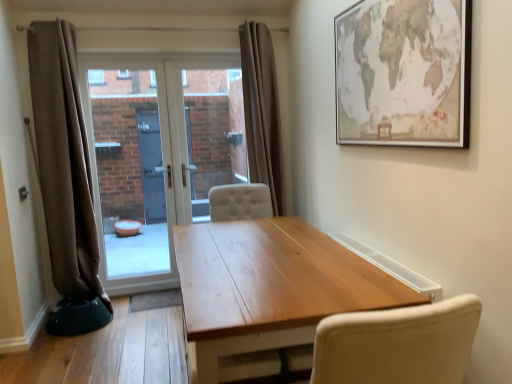
This screenshot has width=512, height=384. What are the coordinates of `wooden table at center` in the screenshot? It's located at (271, 283).

Looking at this image, measure the distance between point [231,253] and camera.

Point [231,253] is 2.28 meters away from camera.

What is the approximate width of brown fabric curtain at center, arranged as the second curtain when viewed from the left?

The width of brown fabric curtain at center, arranged as the second curtain when viewed from the left, is 12.93 inches.

Identify the location of transparent glass door at center, which is counted as the 1th window screen, starting from the left. The image size is (512, 384). (133, 170).

This screenshot has height=384, width=512. Find the location of `wooden table at center`. wooden table at center is located at coordinates (271, 283).

Considering the sizes of wooden table at center and transparent glass door at center, acting as the 1th window screen starting from the right, in the image, is wooden table at center taller or shorter than transparent glass door at center, acting as the 1th window screen starting from the right,?

Considering their sizes, wooden table at center has less height than transparent glass door at center, acting as the 1th window screen starting from the right.

Is wooden table at center touching transparent glass door at center, acting as the 1th window screen starting from the right?

No.

From the image's perspective, is wooden table at center located beneath transparent glass door at center, acting as the 1th window screen starting from the right?

Yes.

Is brown fabric curtain at left, which is the 2th curtain from right to left, not near brown fabric curtain at center, arranged as the second curtain when viewed from the left?

Indeed, brown fabric curtain at left, which is the 2th curtain from right to left, is not near brown fabric curtain at center, arranged as the second curtain when viewed from the left.

Is brown fabric curtain at left, which is the 2th curtain from right to left, oriented towards brown fabric curtain at center, the 1th curtain from the right?

No.

Between point (46, 81) and point (281, 203), which one is positioned in front?

The point (46, 81) is closer.

From the image's perspective, is brown fabric curtain at center, the 1th curtain from the right, on brown fabric curtain at left, which is the 2th curtain from right to left?

Yes.

Can you confirm if brown fabric curtain at center, arranged as the second curtain when viewed from the left, is taller than brown fabric curtain at left, the 1th curtain from the left?

Incorrect, the height of brown fabric curtain at center, arranged as the second curtain when viewed from the left, is not larger of that of brown fabric curtain at left, the 1th curtain from the left.

Which is behind, brown fabric curtain at center, arranged as the second curtain when viewed from the left, or brown fabric curtain at left, which is the 2th curtain from right to left?

brown fabric curtain at center, arranged as the second curtain when viewed from the left.

At what (x,y) coordinates should I click in order to perform the action: click on curtain behind the brown fabric curtain at left, which is the 2th curtain from right to left. Please return your answer as a coordinate pair (x, y). This screenshot has height=384, width=512. Looking at the image, I should click on (262, 110).

Considering the sizes of objects brown fabric curtain at center, arranged as the second curtain when viewed from the left, and white glossy door at center in the image provided, who is thinner, brown fabric curtain at center, arranged as the second curtain when viewed from the left, or white glossy door at center?

white glossy door at center.

Consider the image. Is brown fabric curtain at center, arranged as the second curtain when viewed from the left, not within white glossy door at center?

brown fabric curtain at center, arranged as the second curtain when viewed from the left, lies outside white glossy door at center's area.

From the image's perspective, between brown fabric curtain at center, arranged as the second curtain when viewed from the left, and white glossy door at center, which one is located above?

brown fabric curtain at center, arranged as the second curtain when viewed from the left.

Which is behind, point (261, 127) or point (206, 204)?

Positioned behind is point (206, 204).

From the image's perspective, is wooden table at center over white glossy door at center?

Actually, wooden table at center appears below white glossy door at center in the image.

From the picture: Would you consider wooden table at center to be distant from white glossy door at center?

Yes.

From a real-world perspective, which object rests below the other?

From a 3D spatial view, wooden table at center is below.

Where is `table below the white glossy door at center (from the image's perspective)`? Image resolution: width=512 pixels, height=384 pixels. table below the white glossy door at center (from the image's perspective) is located at coordinates (271, 283).

Which is behind, point (358, 295) or point (277, 130)?

The point (277, 130) is behind.

Is wooden table at center inside the boundaries of brown fabric curtain at center, the 1th curtain from the right, or outside?

The correct answer is: outside.

From the image's perspective, is wooden table at center below brown fabric curtain at center, the 1th curtain from the right?

Indeed, from the image's perspective, wooden table at center is shown beneath brown fabric curtain at center, the 1th curtain from the right.

Considering the relative sizes of white glossy door at center and wooden table at center in the image provided, is white glossy door at center shorter than wooden table at center?

In fact, white glossy door at center may be taller than wooden table at center.

From a real-world perspective, is white glossy door at center over wooden table at center?

Yes, from a real-world perspective, white glossy door at center is over wooden table at center

Is white glossy door at center at the right side of wooden table at center?

No, white glossy door at center is not to the right of wooden table at center.

Is white glossy door at center positioned beyond the bounds of wooden table at center?

Indeed, white glossy door at center is completely outside wooden table at center.

Where is `table in front of the transparent glass door at center, which is the second window screen from left to right`? table in front of the transparent glass door at center, which is the second window screen from left to right is located at coordinates (271, 283).

Find the location of a particular element. Image resolution: width=512 pixels, height=384 pixels. curtain behind the brown fabric curtain at left, the 1th curtain from the left is located at coordinates (262, 110).

Which object lies nearer to the anchor point brown fabric curtain at center, arranged as the second curtain when viewed from the left, matte paper map at upper right or transparent glass door at center, acting as the 1th window screen starting from the right?

Among the two, transparent glass door at center, acting as the 1th window screen starting from the right, is located nearer to brown fabric curtain at center, arranged as the second curtain when viewed from the left.

Looking at the image, which one is located further to matte paper map at upper right, brown fabric curtain at center, arranged as the second curtain when viewed from the left, or wooden table at center?

brown fabric curtain at center, arranged as the second curtain when viewed from the left, lies further to matte paper map at upper right than the other object.

Looking at the image, which one is located closer to brown fabric curtain at center, arranged as the second curtain when viewed from the left, white glossy door at center or transparent glass door at center, which is counted as the 1th window screen, starting from the left?

white glossy door at center lies closer to brown fabric curtain at center, arranged as the second curtain when viewed from the left, than the other object.

From the image, which object appears to be farther from wooden table at center, transparent glass door at center, which is counted as the 1th window screen, starting from the left, or brown fabric curtain at center, arranged as the second curtain when viewed from the left?

transparent glass door at center, which is counted as the 1th window screen, starting from the left, is further to wooden table at center.

Looking at the image, which one is located further to matte paper map at upper right, brown fabric curtain at center, the 1th curtain from the right, or brown fabric curtain at left, which is the 2th curtain from right to left?

brown fabric curtain at left, which is the 2th curtain from right to left, is further to matte paper map at upper right.

From the image, which object appears to be nearer to wooden table at center, brown fabric curtain at center, the 1th curtain from the right, or brown fabric curtain at left, which is the 2th curtain from right to left?

Among the two, brown fabric curtain at center, the 1th curtain from the right, is located nearer to wooden table at center.

Considering their positions, is transparent glass door at center, which is counted as the 1th window screen, starting from the left, positioned closer to transparent glass door at center, which is the second window screen from left to right, than white glossy door at center?

The object closer to transparent glass door at center, which is the second window screen from left to right, is white glossy door at center.

Looking at the image, which one is located closer to transparent glass door at center, acting as the 1th window screen starting from the right, white glossy door at center or matte paper map at upper right?

Based on the image, white glossy door at center appears to be nearer to transparent glass door at center, acting as the 1th window screen starting from the right.

Find the location of a particular element. door located between transparent glass door at center, which is the 2th window screen from right to left, and brown fabric curtain at center, the 1th curtain from the right, in the left-right direction is located at coordinates (158, 155).

Where is `table between brown fabric curtain at left, which is the 2th curtain from right to left, and matte paper map at upper right`? table between brown fabric curtain at left, which is the 2th curtain from right to left, and matte paper map at upper right is located at coordinates (271, 283).

You are a GUI agent. You are given a task and a screenshot of the screen. Output one action in this format:
    pyautogui.click(x=<x>, y=<y>)
    Task: Click on the window screen positioned between matte paper map at upper right and white glossy door at center from near to far
    The image size is (512, 384).
    Given the screenshot: What is the action you would take?
    pyautogui.click(x=133, y=170)

You are a GUI agent. You are given a task and a screenshot of the screen. Output one action in this format:
    pyautogui.click(x=<x>, y=<y>)
    Task: Click on the picture frame positioned between wooden table at center and transparent glass door at center, which is counted as the 1th window screen, starting from the left, from near to far
    
    Given the screenshot: What is the action you would take?
    pyautogui.click(x=403, y=73)